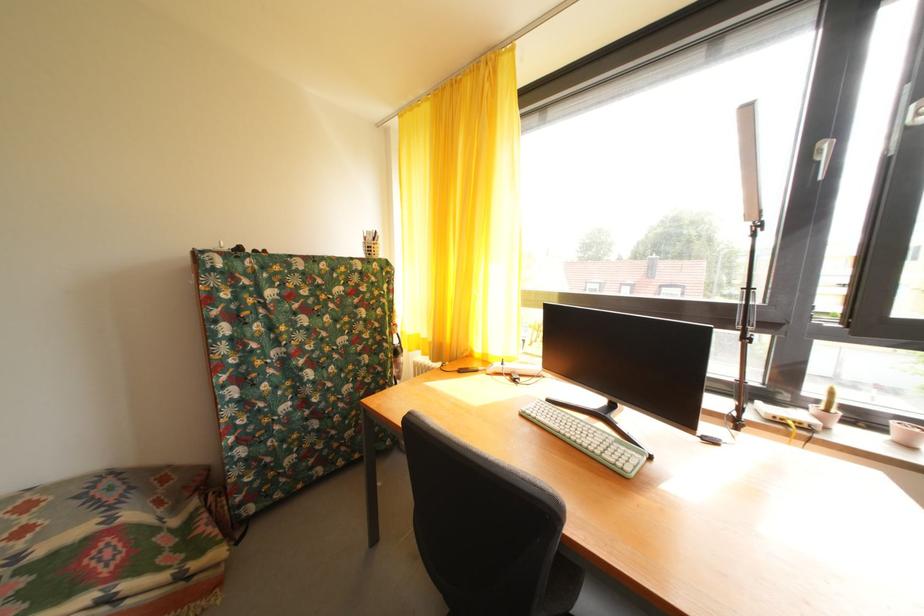
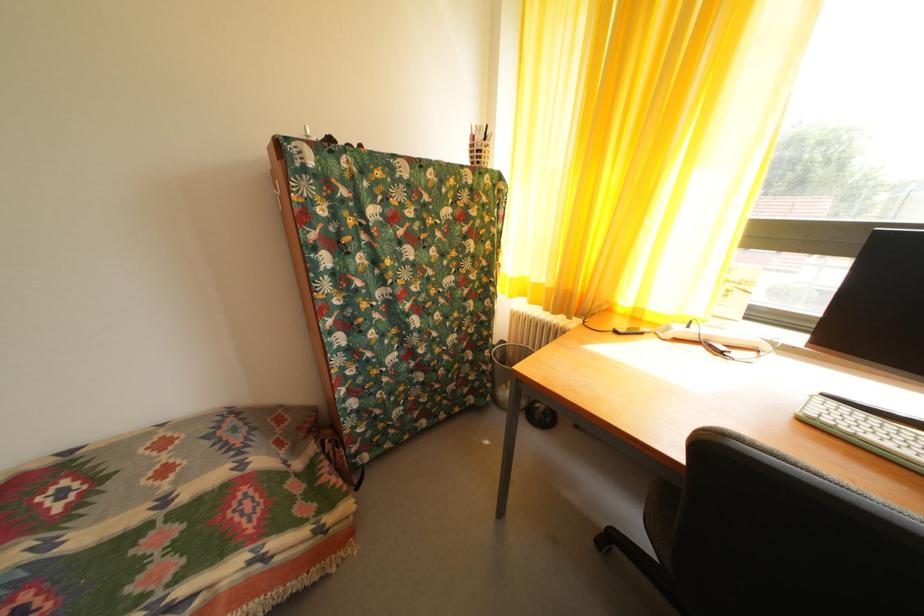
Question: The images are taken continuously from a first-person perspective. In which direction is your viewpoint rotating?

Choices:
 (A) Left
 (B) Right
 (C) Up
 (D) Down

Answer: (D)